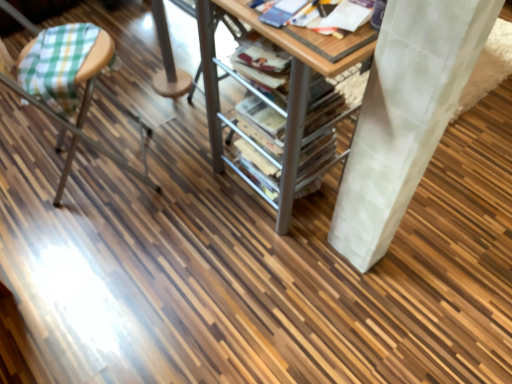
What are the coordinates of `vacant area that is in front of wooden table at center` in the screenshot? It's located at (218, 282).